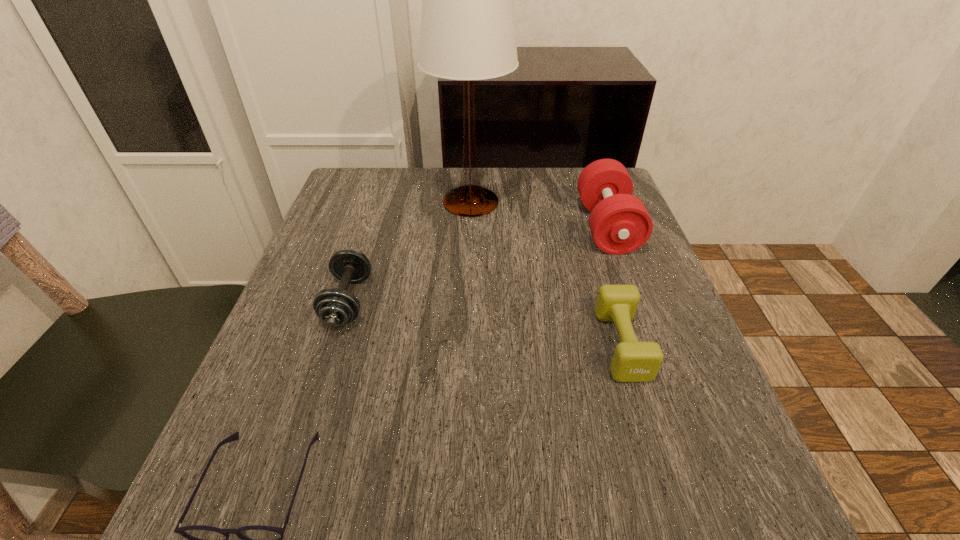
The width and height of the screenshot is (960, 540). Identify the location of free area in between the leftmost dumbbell and the second tallest object. (477, 264).

Find the location of a particular element. The image size is (960, 540). object that is the nearest to the tallest object is located at coordinates (619, 222).

I want to click on object that is the second closest to the shortest object, so click(x=633, y=361).

At what (x,y) coordinates should I click in order to perform the action: click on dumbbell that is the second closest to the shortest object. Please return your answer as a coordinate pair (x, y). This screenshot has height=540, width=960. Looking at the image, I should click on (633, 361).

Identify which dumbbell is the nearest to the shortest object. Please provide its 2D coordinates. Your answer should be formatted as a tuple, i.e. [(x, y)], where the tuple contains the x and y coordinates of a point satisfying the conditions above.

[(335, 307)]

At what (x,y) coordinates should I click in order to perform the action: click on free space that satisfies the following two spatial constraints: 1. above the cylindrical shade of the farthest dumbbell; 2. on the left side of the third object from right to left. Please return your answer as a coordinate pair (x, y). The width and height of the screenshot is (960, 540). Looking at the image, I should click on (469, 227).